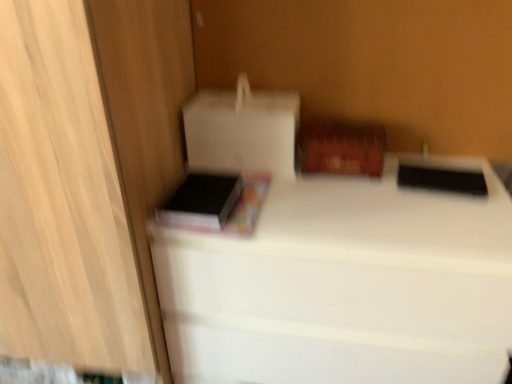
Find the location of `free space above white matte bed at center (from a real-world perspective)`. free space above white matte bed at center (from a real-world perspective) is located at coordinates (339, 188).